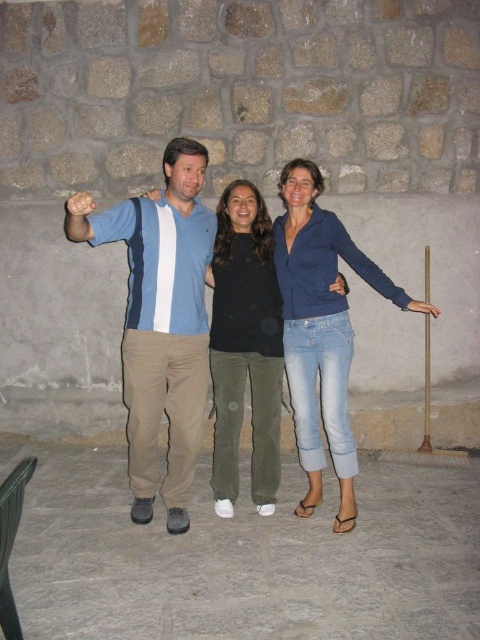
Question: Which object is farther from the camera taking this photo?

Choices:
 (A) blue striped shirt at center
 (B) black matte shirt at center

Answer: (B)

Question: Which point is farther from the camera taking this photo?

Choices:
 (A) (66, 230)
 (B) (231, 454)
 (C) (296, 166)
 (D) (184, 198)

Answer: (B)

Question: Does blue denim jeans at center appear on the left side of black matte shirt at center?

Choices:
 (A) no
 (B) yes

Answer: (A)

Question: In this image, where is smooth stone floor at center located relative to blue denim jeans at center?

Choices:
 (A) below
 (B) above

Answer: (A)

Question: Does blue striped shirt at center have a smaller size compared to blue denim jeans at center?

Choices:
 (A) no
 (B) yes

Answer: (A)

Question: Considering the real-world distances, which object is farthest from the blue fabric shirt at left?

Choices:
 (A) blue smooth shirt at right
 (B) smooth stone floor at center
 (C) black matte shirt at center
 (D) blue denim jeans at center

Answer: (B)